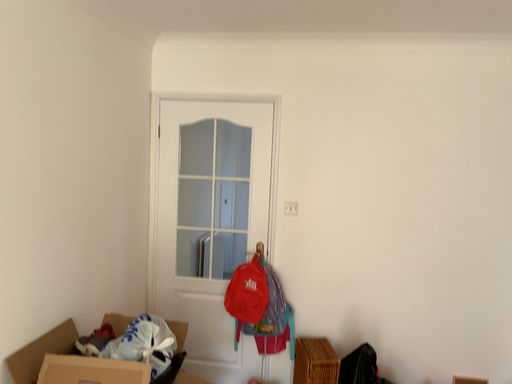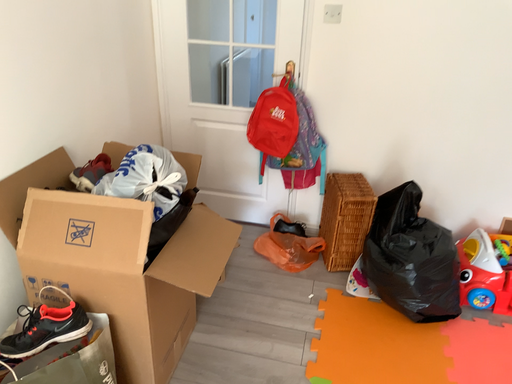
Question: How did the camera likely rotate when shooting the video?

Choices:
 (A) rotated upward
 (B) rotated downward

Answer: (B)